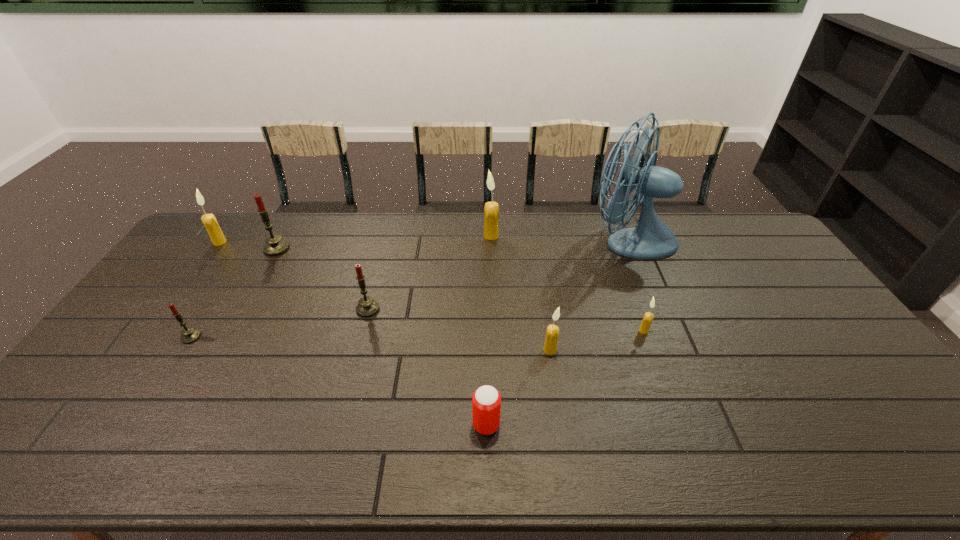
Locate an element on the screen. The width and height of the screenshot is (960, 540). object positioned at the left edge is located at coordinates (217, 237).

At what (x,y) coordinates should I click in order to perform the action: click on object that is at the far left corner. Please return your answer as a coordinate pair (x, y). Image resolution: width=960 pixels, height=540 pixels. Looking at the image, I should click on (217, 237).

What are the coordinates of `vacant position at the far edge of the desktop` in the screenshot? It's located at click(x=558, y=228).

In the image, there is a desktop. At what (x,y) coordinates should I click in order to perform the action: click on vacant space at the left edge. Please return your answer as a coordinate pair (x, y). The height and width of the screenshot is (540, 960). Looking at the image, I should click on (105, 422).

You are a GUI agent. You are given a task and a screenshot of the screen. Output one action in this format:
    pyautogui.click(x=<x>, y=<y>)
    Task: Click on the free spot at the right edge of the desktop
    The height and width of the screenshot is (540, 960).
    Given the screenshot: What is the action you would take?
    pyautogui.click(x=856, y=359)

I want to click on vacant space at the far left corner of the desktop, so click(x=220, y=221).

Locate an element on the screen. This screenshot has width=960, height=540. empty space that is in between the red beer can and the leftmost red candle is located at coordinates (339, 381).

Locate an element on the screen. Image resolution: width=960 pixels, height=540 pixels. free point between the leftmost object and the second cream candle from left to right is located at coordinates (355, 239).

Locate an element on the screen. This screenshot has height=540, width=960. free space between the rightmost candle and the beer can is located at coordinates (564, 378).

I want to click on free space that is in between the biggest cream candle and the fourth object from left to right, so click(x=429, y=273).